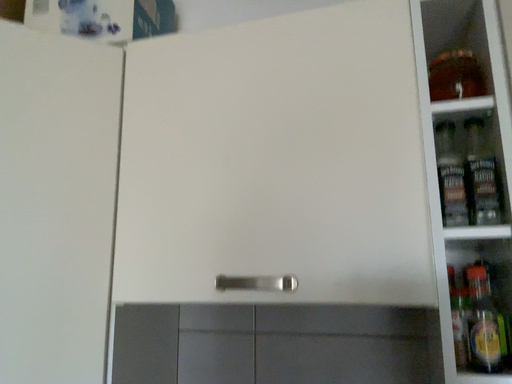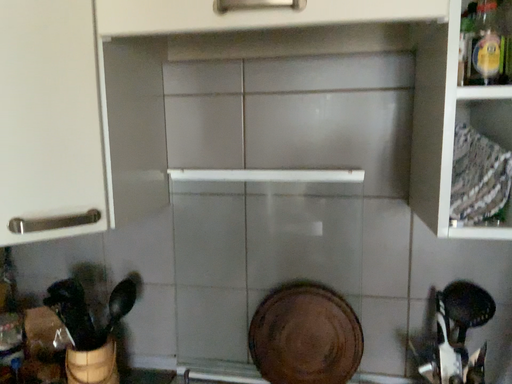
Question: How did the camera likely rotate when shooting the video?

Choices:
 (A) rotated left
 (B) rotated right

Answer: (B)